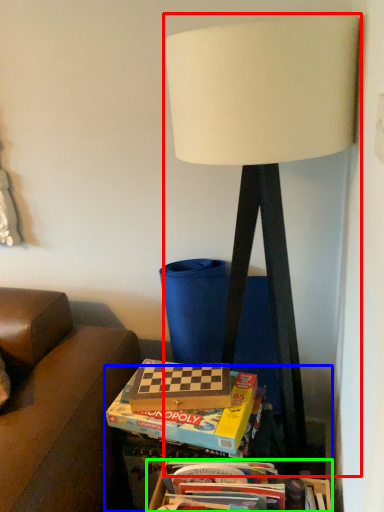
Question: Considering the real-world distances, which object is farthest from lamp (highlighted by a red box)? table (highlighted by a blue box) or box (highlighted by a green box)?

Choices:
 (A) table
 (B) box

Answer: (B)